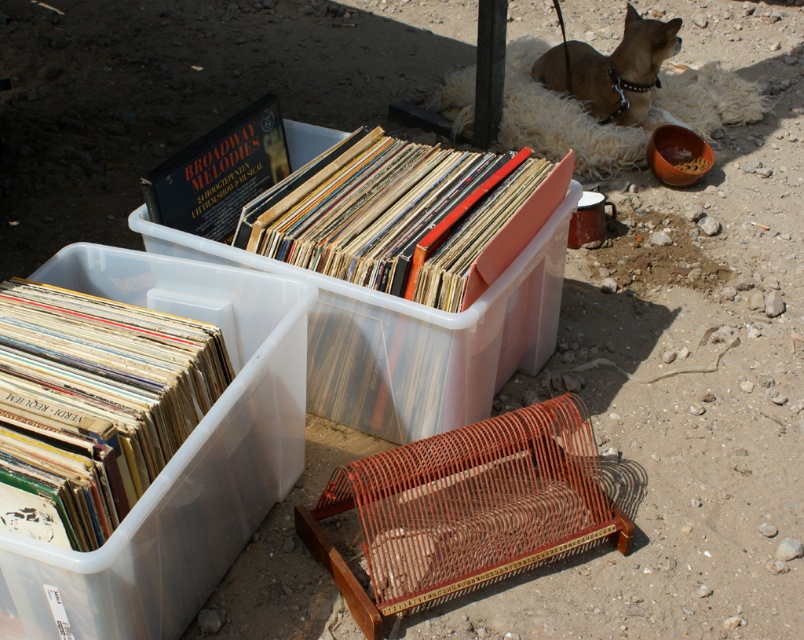
Which is above, multicolored vinyl records at lower left or matte vinyl records at center?

Positioned higher is matte vinyl records at center.

Does multicolored vinyl records at lower left lie behind matte vinyl records at center?

No, it is in front of matte vinyl records at center.

Is point (126, 326) farther from viewer compared to point (347, 250)?

No.

At what (x,y) coordinates should I click in order to perform the action: click on multicolored vinyl records at lower left. Please return your answer as a coordinate pair (x, y). Looking at the image, I should click on (93, 404).

Between point (515, 314) and point (527, 177), which one is positioned behind?

The point (515, 314) is more distant.

Which is in front, point (444, 355) or point (380, 224)?

Point (444, 355) is more forward.

The width and height of the screenshot is (804, 640). Find the location of `clear plastic container at upper center`. clear plastic container at upper center is located at coordinates (409, 336).

Between clear plastic container at upper center and brown fur dog at upper right, which one appears on the right side from the viewer's perspective?

brown fur dog at upper right is more to the right.

What do you see at coordinates (409, 336) in the screenshot? The height and width of the screenshot is (640, 804). I see `clear plastic container at upper center` at bounding box center [409, 336].

Locate an element on the screen. The width and height of the screenshot is (804, 640). clear plastic container at upper center is located at coordinates (409, 336).